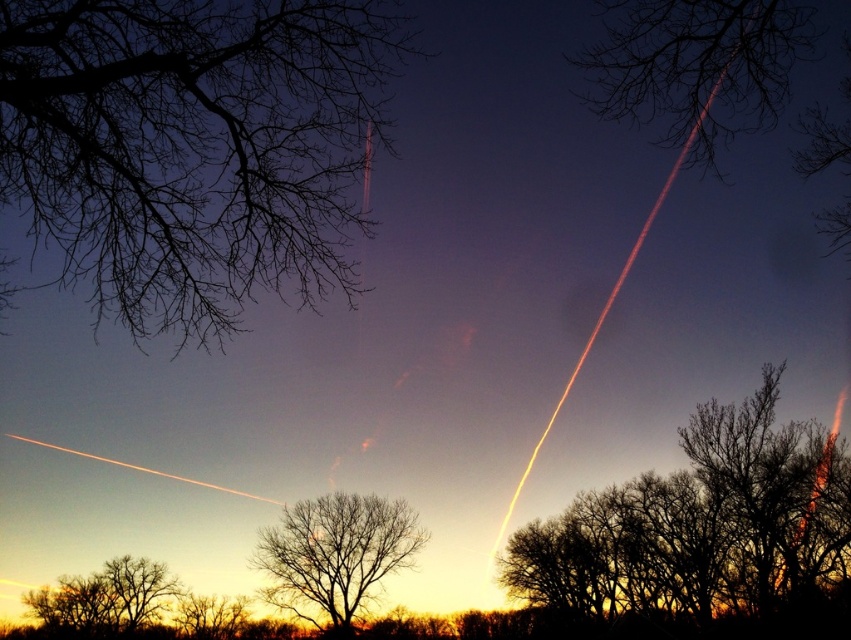
You are an astronomer observing the night sky and notice the brown leafless tree at center and the silhouette bare tree at upper right. Which tree would block your view of a star located directly behind both trees?

The brown leafless tree at center would block your view of the star first because it is closer to you than the silhouette bare tree at upper right.

You are an ornithologist observing the twilight scene. You notice the silhouette bare tree at upper right and the bare branches at center. Which of these two objects appears smaller in the image?

The silhouette bare tree at upper right appears smaller compared to the bare branches at center.

You are an astronomer observing the twilight sky and notice the brown leafless tree at center and the silhouette bare tree at upper right. Which tree is closer to the horizon?

The silhouette bare tree at upper right is closer to the horizon because it is positioned higher in the sky than the brown leafless tree at center.